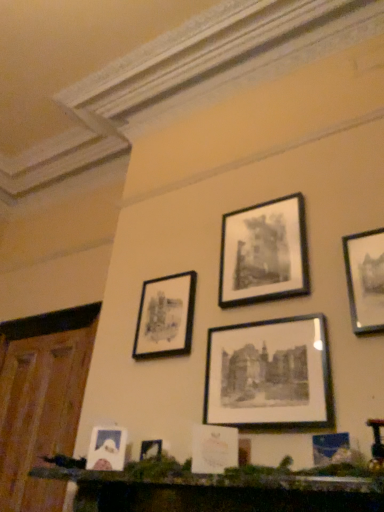
Question: Based on their positions, is black matte picture frame at upper center, which is the 2th picture frame in right-to-left order, located to the left or right of wooden at left?

Choices:
 (A) right
 (B) left

Answer: (A)

Question: Does point (288, 236) appear closer or farther from the camera than point (44, 424)?

Choices:
 (A) farther
 (B) closer

Answer: (B)

Question: Considering the real-world distances, which object is closest to the wooden mantelpiece at lower center?

Choices:
 (A) matte black picture frame at upper center, the second picture frame viewed from the left
 (B) black matte picture frame at upper center, placed as the 5th picture frame when sorted from left to right
 (C) matte white picture frame at lower left, which ranks as the 6th picture frame in right-to-left order
 (D) black matte picture frame at center, the 3th picture frame from the right
 (E) matte black picture frame at upper right, arranged as the 1th picture frame when viewed from the right

Answer: (C)

Question: Estimate the real-world distances between objects in this image. Which object is farther from the matte black picture frame at upper center, the 5th picture frame when ordered from right to left?

Choices:
 (A) black matte picture frame at center, which appears as the fourth picture frame when viewed from the left
 (B) wooden at left
 (C) black matte picture frame at upper center, which is the 2th picture frame in right-to-left order
 (D) matte white picture frame at lower left, which ranks as the 6th picture frame in right-to-left order
 (E) matte black picture frame at upper right, arranged as the 1th picture frame when viewed from the right

Answer: (B)